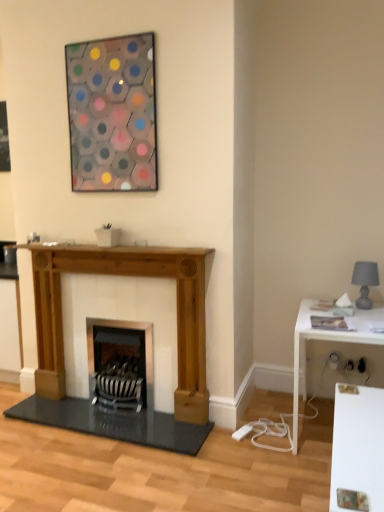
Question: Can you confirm if metallic hexagonal artwork at upper center is taller than gray fabric lampshade at right?

Choices:
 (A) no
 (B) yes

Answer: (B)

Question: Does metallic hexagonal artwork at upper center have a lesser width compared to gray fabric lampshade at right?

Choices:
 (A) no
 (B) yes

Answer: (B)

Question: Is metallic hexagonal artwork at upper center positioned in front of gray fabric lampshade at right?

Choices:
 (A) yes
 (B) no

Answer: (A)

Question: Can you see metallic hexagonal artwork at upper center touching gray fabric lampshade at right?

Choices:
 (A) yes
 (B) no

Answer: (B)

Question: Is metallic hexagonal artwork at upper center further to the viewer compared to gray fabric lampshade at right?

Choices:
 (A) no
 (B) yes

Answer: (A)

Question: Is metallic hexagonal artwork at upper center oriented towards gray fabric lampshade at right?

Choices:
 (A) yes
 (B) no

Answer: (B)

Question: Would you say natural wood fireplace at center contains metallic hexagonal artwork at upper center?

Choices:
 (A) no
 (B) yes

Answer: (A)

Question: From the image's perspective, would you say natural wood fireplace at center is positioned over metallic hexagonal artwork at upper center?

Choices:
 (A) no
 (B) yes

Answer: (A)

Question: Does natural wood fireplace at center appear on the left side of metallic hexagonal artwork at upper center?

Choices:
 (A) no
 (B) yes

Answer: (A)

Question: Can you confirm if natural wood fireplace at center is thinner than metallic hexagonal artwork at upper center?

Choices:
 (A) no
 (B) yes

Answer: (A)

Question: Is natural wood fireplace at center next to metallic hexagonal artwork at upper center?

Choices:
 (A) yes
 (B) no

Answer: (B)

Question: Does natural wood fireplace at center have a greater height compared to metallic hexagonal artwork at upper center?

Choices:
 (A) yes
 (B) no

Answer: (A)

Question: Is metallic hexagonal artwork at upper center at the left side of white glossy table at right?

Choices:
 (A) yes
 (B) no

Answer: (A)